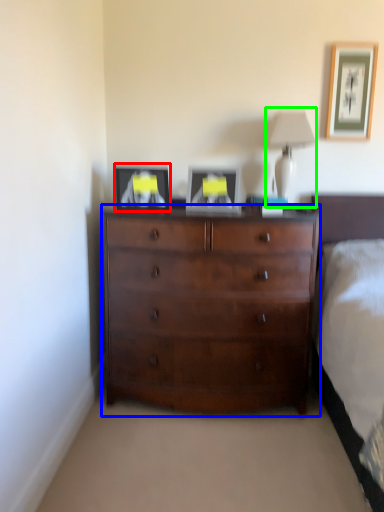
Question: Considering the real-world distances, which object is closest to picture frame (highlighted by a red box)? chest of drawers (highlighted by a blue box) or table lamp (highlighted by a green box).

Choices:
 (A) chest of drawers
 (B) table lamp

Answer: (A)